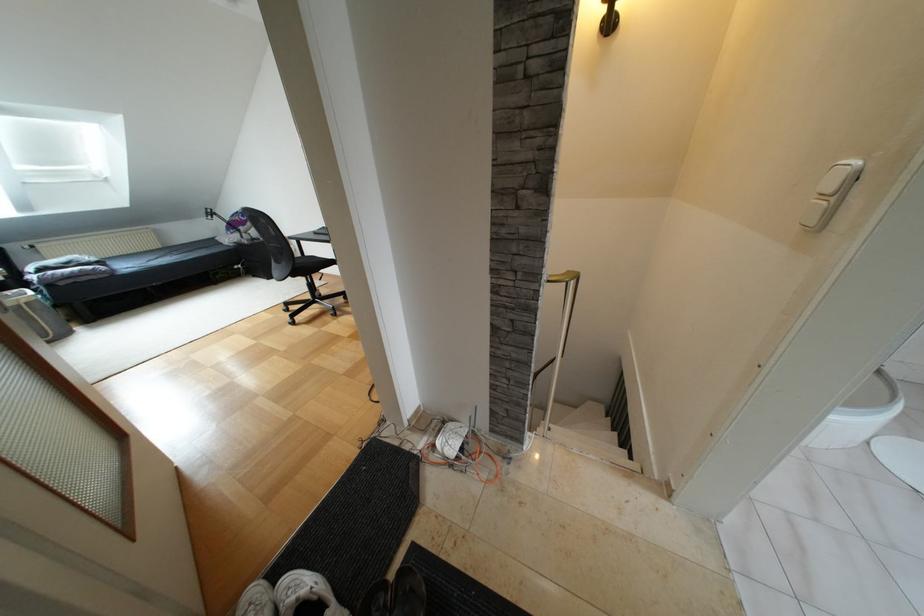
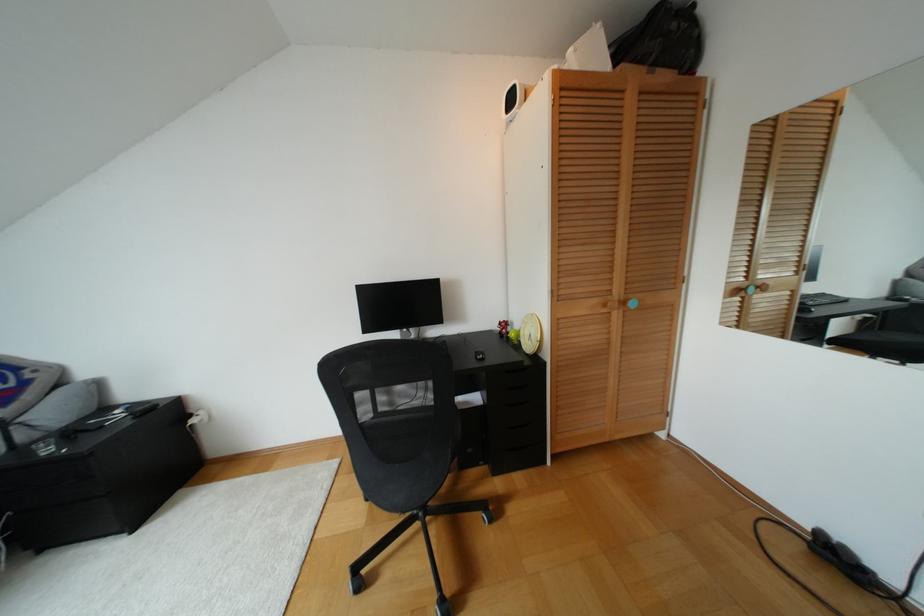
Where in the second image is the point corresponding to the point at 286,310 from the first image?

(359, 585)